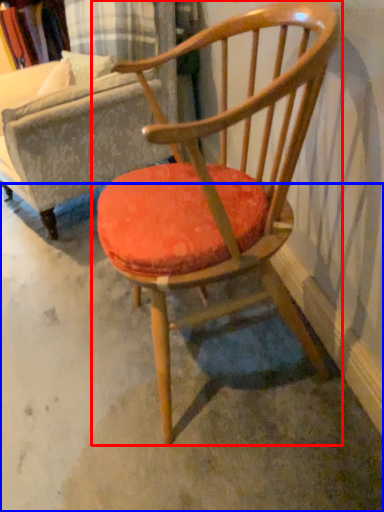
Question: Which point is further to the camera, chair (highlighted by a red box) or concrete (highlighted by a blue box)?

Choices:
 (A) chair
 (B) concrete

Answer: (B)